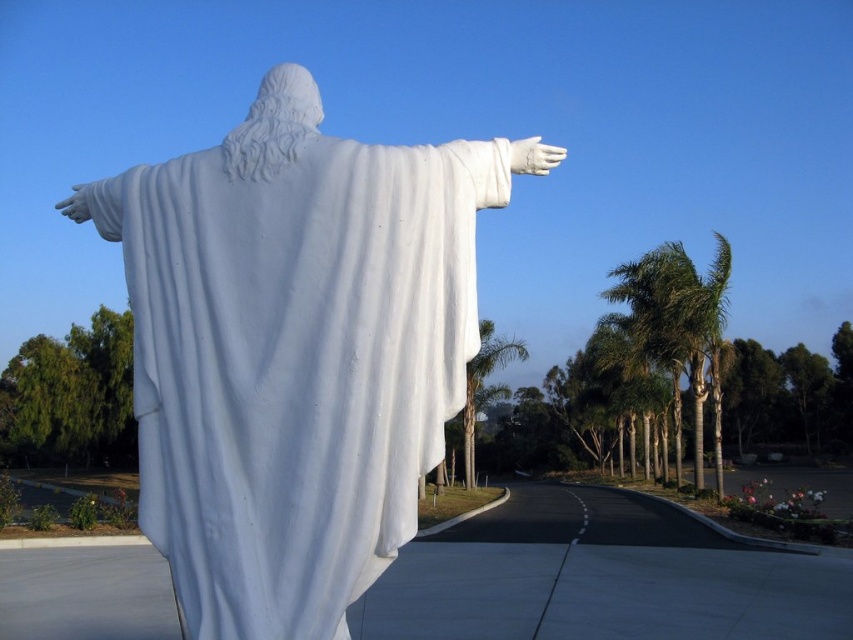
Does white marble statue at center appear under green leafy palm tree at center?

No.

This screenshot has width=853, height=640. Describe the element at coordinates (294, 349) in the screenshot. I see `white marble statue at center` at that location.

Identify the location of white marble statue at center. (294, 349).

Between white marble statue at center and green leafy palm trees at right, which one has more height?

With more height is green leafy palm trees at right.

Locate an element on the screen. The height and width of the screenshot is (640, 853). white marble statue at center is located at coordinates (294, 349).

Is point (712, 285) closer to viewer compared to point (525, 348)?

Yes, it is in front of point (525, 348).

Is green leafy palm trees at right smaller than green leafy palm tree at center?

No, green leafy palm trees at right is not smaller than green leafy palm tree at center.

Between point (669, 298) and point (469, 380), which one is positioned behind?

Positioned behind is point (469, 380).

The height and width of the screenshot is (640, 853). Find the location of `green leafy palm trees at right`. green leafy palm trees at right is located at coordinates (677, 324).